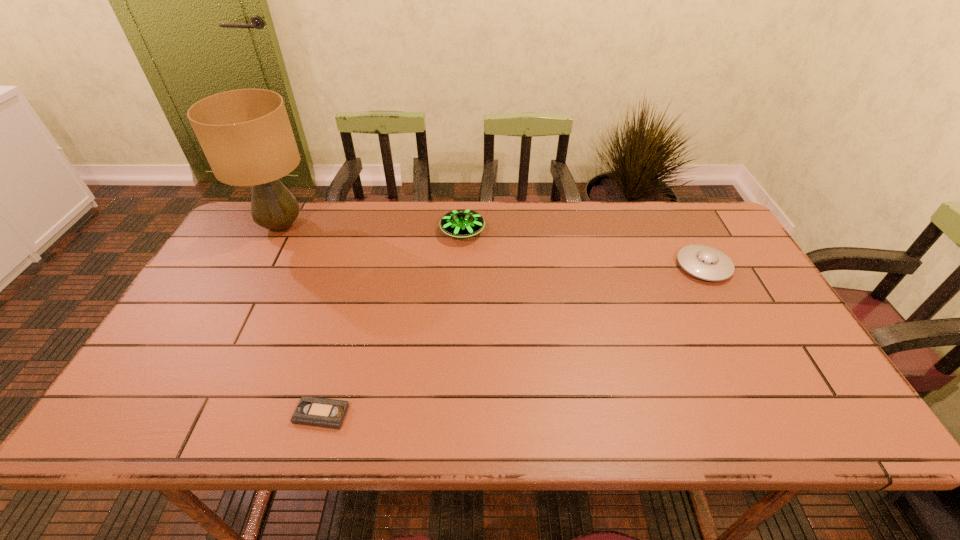
Where is `free space located on the front of the shorter saucer`? This screenshot has height=540, width=960. free space located on the front of the shorter saucer is located at coordinates (722, 301).

Identify the location of vacant space located 0.110m on the right of the shortest object. (398, 414).

The height and width of the screenshot is (540, 960). In order to click on lampshade at the far edge in this screenshot , I will do `click(246, 136)`.

What are the coordinates of `saucer that is at the far edge` in the screenshot? It's located at (462, 223).

Where is `object situated at the near edge`? object situated at the near edge is located at coordinates (311, 411).

You are a GUI agent. You are given a task and a screenshot of the screen. Output one action in this format:
    pyautogui.click(x=<x>, y=<y>)
    Task: Click on the object present at the left edge
    The height and width of the screenshot is (540, 960).
    Given the screenshot: What is the action you would take?
    click(246, 136)

Identify the location of object present at the right edge. (707, 263).

Where is `object that is at the far left corner`? This screenshot has height=540, width=960. object that is at the far left corner is located at coordinates (246, 136).

This screenshot has height=540, width=960. I want to click on free spot at the far edge of the desktop, so click(x=643, y=214).

In the image, there is a desktop. At what (x,y) coordinates should I click in order to perform the action: click on vacant space at the near edge. Please return your answer as a coordinate pair (x, y). The image size is (960, 540). Looking at the image, I should click on (622, 424).